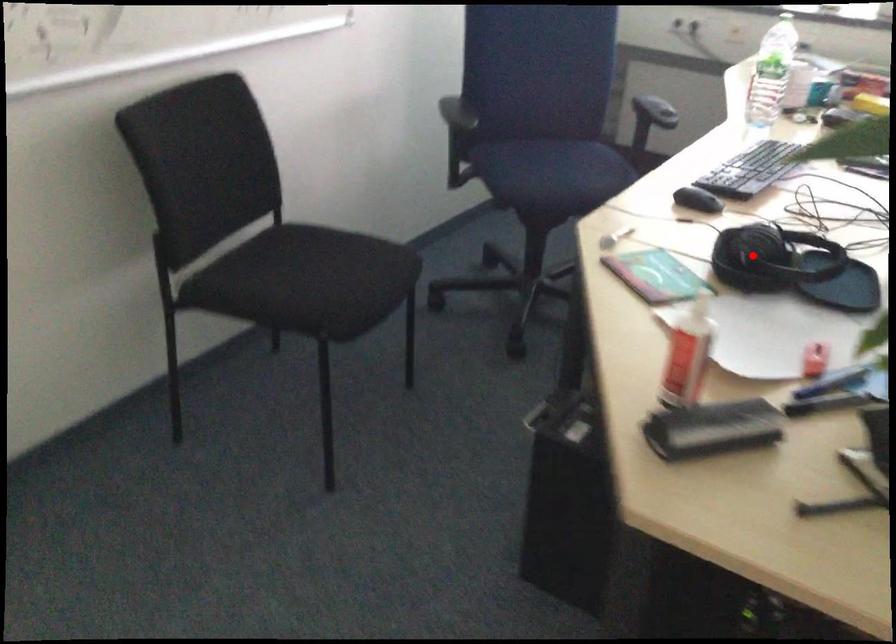
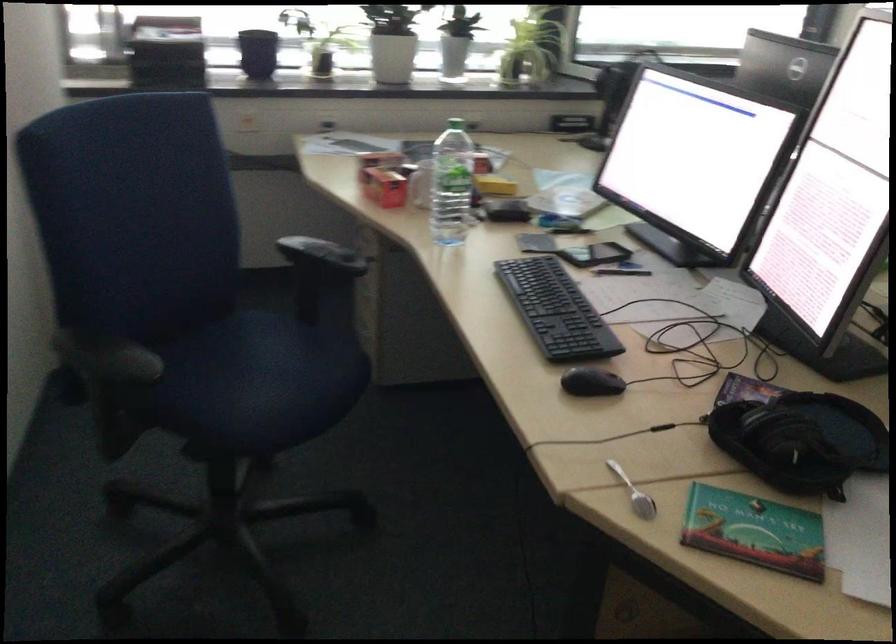
Where in the second image is the point corresponding to the highlighted location from the first image?

(800, 440)